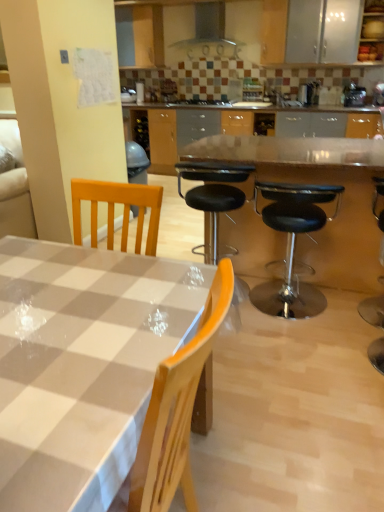
Find the location of a particular element. metallic silver toaster at upper right is located at coordinates (353, 94).

Describe the element at coordinates (372, 32) in the screenshot. I see `wooden cabinet at upper right` at that location.

Find the location of a particular element. The width and height of the screenshot is (384, 512). checkered plastic table at center is located at coordinates (81, 365).

What do you see at coordinates (203, 101) in the screenshot?
I see `black glass gas stove at center` at bounding box center [203, 101].

What do you see at coordinates (373, 310) in the screenshot? I see `black leather bar stool at right` at bounding box center [373, 310].

Identify the location of metallic gray exhaust hood at upper center. (210, 32).

What do you see at coordinates (213, 198) in the screenshot? This screenshot has height=512, width=384. I see `black leather stool at center, the 2th chair positioned from the right` at bounding box center [213, 198].

The width and height of the screenshot is (384, 512). I want to click on metallic silver toaster at upper right, so click(353, 94).

Which object is closer to the camera, checkered plastic table at center or black leather bar stool at right?

checkered plastic table at center.

Which is nearer, (31, 329) or (363, 317)?

Point (31, 329).

From the image's perspective, is checkered plastic table at center located above or below black leather bar stool at right?

From the image's perspective, checkered plastic table at center appears below black leather bar stool at right.

Is wooden cabinet at upper right looking in the opposite direction of transparent glass table at center?

wooden cabinet at upper right does not have its back to transparent glass table at center.

In the scene shown: From the image's perspective, who appears lower, wooden cabinet at upper right or transparent glass table at center?

transparent glass table at center appears lower in the image.

You are a GUI agent. You are given a task and a screenshot of the screen. Output one action in this format:
    pyautogui.click(x=<x>, y=<y>)
    Task: Click on the cabinetry that is above the transparent glass table at center (from a real-world perspective)
    The height and width of the screenshot is (512, 384).
    Given the screenshot: What is the action you would take?
    pyautogui.click(x=372, y=32)

Does black glass gas stove at center appear on the left side of metallic silver toaster at upper right?

Indeed, black glass gas stove at center is positioned on the left side of metallic silver toaster at upper right.

From the image's perspective, is black glass gas stove at center located above or below metallic silver toaster at upper right?

black glass gas stove at center is above metallic silver toaster at upper right.

In terms of size, does black glass gas stove at center appear bigger or smaller than metallic silver toaster at upper right?

black glass gas stove at center is bigger than metallic silver toaster at upper right.

In the scene shown: Could you measure the distance between black leather stool at center, the 2th chair positioned from the right, and metallic silver toaster at upper right?

black leather stool at center, the 2th chair positioned from the right, and metallic silver toaster at upper right are 4.02 meters apart from each other.

Can you confirm if black leather stool at center, marked as the first chair in a left-to-right arrangement, is taller than metallic silver toaster at upper right?

Indeed, black leather stool at center, marked as the first chair in a left-to-right arrangement, has a greater height compared to metallic silver toaster at upper right.

In the scene shown: From a real-world perspective, relative to metallic silver toaster at upper right, is black leather stool at center, marked as the first chair in a left-to-right arrangement, vertically above or below?

Clearly, from a real-world perspective, black leather stool at center, marked as the first chair in a left-to-right arrangement, is below metallic silver toaster at upper right.

Could you tell me if black leather stool at center, the 2th chair positioned from the right, is facing metallic silver toaster at upper right?

Yes.

Considering the sizes of black leather stool at center, marked as the 1th chair in a right-to-left arrangement, and metallic silver toaster at upper right in the image, is black leather stool at center, marked as the 1th chair in a right-to-left arrangement, bigger or smaller than metallic silver toaster at upper right?

Clearly, black leather stool at center, marked as the 1th chair in a right-to-left arrangement, is larger in size than metallic silver toaster at upper right.

Is black leather stool at center, the second chair in the left-to-right sequence, positioned far away from metallic silver toaster at upper right?

Yes, black leather stool at center, the second chair in the left-to-right sequence, and metallic silver toaster at upper right are located far from each other.

Considering the relative sizes of black leather stool at center, the second chair in the left-to-right sequence, and metallic silver toaster at upper right in the image provided, is black leather stool at center, the second chair in the left-to-right sequence, shorter than metallic silver toaster at upper right?

No.

Could metallic silver toaster at upper right be considered to be inside black leather stool at center, the second chair in the left-to-right sequence?

That's incorrect, metallic silver toaster at upper right is not inside black leather stool at center, the second chair in the left-to-right sequence.

Considering the relative sizes of black leather stool at center, the second chair in the left-to-right sequence, and transparent glass table at center in the image provided, is black leather stool at center, the second chair in the left-to-right sequence, thinner than transparent glass table at center?

Indeed, black leather stool at center, the second chair in the left-to-right sequence, has a lesser width compared to transparent glass table at center.

Can you confirm if black leather stool at center, the second chair in the left-to-right sequence, is smaller than transparent glass table at center?

Indeed, black leather stool at center, the second chair in the left-to-right sequence, has a smaller size compared to transparent glass table at center.

Is point (272, 192) farther from viewer compared to point (315, 236)?

No, it is not.

Between black leather stool at center, marked as the 1th chair in a right-to-left arrangement, and transparent glass table at center, which one appears on the left side from the viewer's perspective?

From the viewer's perspective, black leather stool at center, marked as the 1th chair in a right-to-left arrangement, appears more on the left side.

Is black leather stool at center, the second chair in the left-to-right sequence, looking in the opposite direction of wooden cabinet at upper right?

No, black leather stool at center, the second chair in the left-to-right sequence, is not facing the opposite direction of wooden cabinet at upper right.

Is black leather stool at center, the second chair in the left-to-right sequence, inside the boundaries of wooden cabinet at upper right, or outside?

black leather stool at center, the second chair in the left-to-right sequence, is outside wooden cabinet at upper right.

Which object is more forward, black leather stool at center, the second chair in the left-to-right sequence, or wooden cabinet at upper right?

black leather stool at center, the second chair in the left-to-right sequence, is closer to the camera.

From a real-world perspective, is black leather stool at center, marked as the 1th chair in a right-to-left arrangement, positioned under wooden cabinet at upper right based on gravity?

Yes, from a real-world perspective, black leather stool at center, marked as the 1th chair in a right-to-left arrangement, is below wooden cabinet at upper right.

The height and width of the screenshot is (512, 384). What are the coordinates of `kitchen & dining room table on the left side of black leather bar stool at right` in the screenshot? It's located at click(x=81, y=365).

The height and width of the screenshot is (512, 384). In order to click on cabinetry above the transparent glass table at center (from the image's perspective) in this screenshot , I will do `click(372, 32)`.

From the image, which object appears to be nearer to wooden cabinet at upper right, black glass gas stove at center or checkered plastic table at center?

black glass gas stove at center.

Based on their spatial positions, is black leather bar stool at right or black glass gas stove at center closer to checkered plastic table at center?

black leather bar stool at right.

Which object lies nearer to the anchor point black leather stool at center, marked as the first chair in a left-to-right arrangement, metallic silver toaster at upper right or black glass gas stove at center?

black glass gas stove at center is positioned closer to the anchor black leather stool at center, marked as the first chair in a left-to-right arrangement.

Estimate the real-world distances between objects in this image. Which object is further from black leather stool at center, marked as the first chair in a left-to-right arrangement, metallic gray exhaust hood at upper center or metallic silver toaster at upper right?

The object further to black leather stool at center, marked as the first chair in a left-to-right arrangement, is metallic gray exhaust hood at upper center.

Estimate the real-world distances between objects in this image. Which object is further from black leather bar stool at right, metallic silver toaster at upper right or checkered plastic table at center?

metallic silver toaster at upper right.

Looking at the image, which one is located closer to black leather stool at center, marked as the 1th chair in a right-to-left arrangement, black leather stool at center, marked as the first chair in a left-to-right arrangement, or checkered plastic table at center?

black leather stool at center, marked as the first chair in a left-to-right arrangement, is closer to black leather stool at center, marked as the 1th chair in a right-to-left arrangement.

Which object lies further to the anchor point black leather stool at center, the 2th chair positioned from the right, metallic gray exhaust hood at upper center or wooden cabinet at upper right?

metallic gray exhaust hood at upper center lies further to black leather stool at center, the 2th chair positioned from the right, than the other object.

Considering their positions, is transparent glass table at center positioned further to checkered plastic table at center than black glass gas stove at center?

Based on the image, black glass gas stove at center appears to be further to checkered plastic table at center.

Where is `chair between transparent glass table at center and metallic silver toaster at upper right from front to back`? The image size is (384, 512). chair between transparent glass table at center and metallic silver toaster at upper right from front to back is located at coordinates (213, 198).

This screenshot has height=512, width=384. Find the location of `exhaust hood positioned between black leather bar stool at right and black glass gas stove at center from near to far`. exhaust hood positioned between black leather bar stool at right and black glass gas stove at center from near to far is located at coordinates (210, 32).

Where is `table between black leather bar stool at right and metallic silver toaster at upper right from front to back`? This screenshot has width=384, height=512. table between black leather bar stool at right and metallic silver toaster at upper right from front to back is located at coordinates (317, 183).

Where is `exhaust hood positioned between checkered plastic table at center and black glass gas stove at center from near to far`? Image resolution: width=384 pixels, height=512 pixels. exhaust hood positioned between checkered plastic table at center and black glass gas stove at center from near to far is located at coordinates (210, 32).